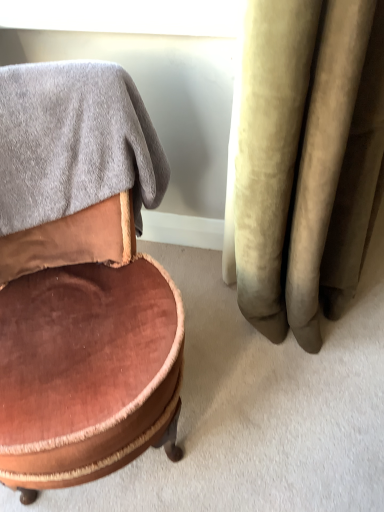
Question: From a real-world perspective, does white glossy window screen at upper center stand above gray soft towel at upper left?

Choices:
 (A) yes
 (B) no

Answer: (A)

Question: Does white glossy window screen at upper center turn towards gray soft towel at upper left?

Choices:
 (A) no
 (B) yes

Answer: (B)

Question: Can you confirm if white glossy window screen at upper center is positioned to the right of gray soft towel at upper left?

Choices:
 (A) yes
 (B) no

Answer: (A)

Question: Does white glossy window screen at upper center have a greater height compared to gray soft towel at upper left?

Choices:
 (A) yes
 (B) no

Answer: (B)

Question: Can you see white glossy window screen at upper center touching gray soft towel at upper left?

Choices:
 (A) yes
 (B) no

Answer: (B)

Question: Relative to white glossy window screen at upper center, is velvet brown ottoman at left in front or behind?

Choices:
 (A) front
 (B) behind

Answer: (A)

Question: Is velvet brown ottoman at left inside the boundaries of white glossy window screen at upper center, or outside?

Choices:
 (A) outside
 (B) inside

Answer: (A)

Question: From the image's perspective, is velvet brown ottoman at left positioned above or below white glossy window screen at upper center?

Choices:
 (A) above
 (B) below

Answer: (B)

Question: Is velvet brown ottoman at left to the left or to the right of white glossy window screen at upper center in the image?

Choices:
 (A) left
 (B) right

Answer: (A)

Question: Relative to velvet brown ottoman at left, is gray soft towel at upper left in front or behind?

Choices:
 (A) behind
 (B) front

Answer: (A)

Question: From a real-world perspective, is gray soft towel at upper left above or below velvet brown ottoman at left?

Choices:
 (A) below
 (B) above

Answer: (B)

Question: Looking at their shapes, would you say gray soft towel at upper left is wider or thinner than velvet brown ottoman at left?

Choices:
 (A) thin
 (B) wide

Answer: (A)

Question: Is gray soft towel at upper left spatially inside velvet brown ottoman at left, or outside of it?

Choices:
 (A) outside
 (B) inside

Answer: (B)

Question: In terms of width, does velvet brown ottoman at left look wider or thinner when compared to gray soft towel at upper left?

Choices:
 (A) thin
 (B) wide

Answer: (B)

Question: From the image's perspective, is velvet brown ottoman at left positioned above or below gray soft towel at upper left?

Choices:
 (A) below
 (B) above

Answer: (A)